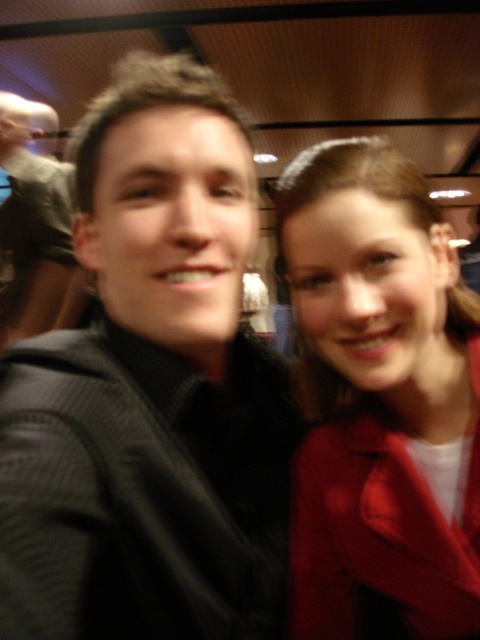
Does matte red coat at right come in front of matte black sweater at center?

Yes.

Measure the distance between point (455, 420) and camera.

Point (455, 420) and camera are 60.69 centimeters apart from each other.

Is point (305, 474) positioned after point (10, 218)?

No.

Where is `matte red coat at right`? This screenshot has width=480, height=640. matte red coat at right is located at coordinates (380, 401).